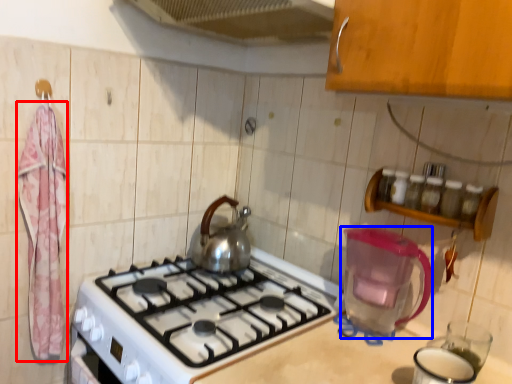
Question: Which point is further to the camera, bath towel (highlighted by a red box) or appliance (highlighted by a blue box)?

Choices:
 (A) bath towel
 (B) appliance

Answer: (A)